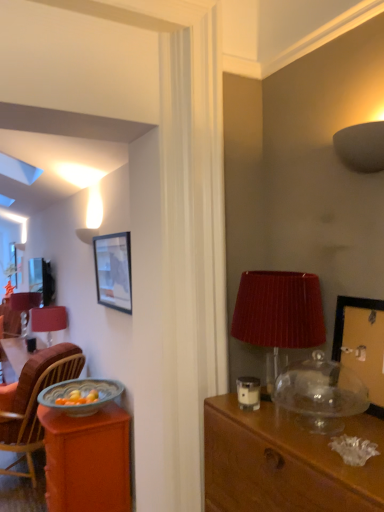
Question: Is wooden picture frame at upper right, the 1th picture frame from the front, placed right next to matte red table lamp at left?

Choices:
 (A) no
 (B) yes

Answer: (A)

Question: Does wooden picture frame at upper right, positioned as the 2th picture frame in left-to-right order, appear on the left side of matte red table lamp at left?

Choices:
 (A) yes
 (B) no

Answer: (B)

Question: Considering the relative sizes of wooden picture frame at upper right, marked as the second picture frame in a back-to-front arrangement, and matte red table lamp at left in the image provided, is wooden picture frame at upper right, marked as the second picture frame in a back-to-front arrangement, shorter than matte red table lamp at left?

Choices:
 (A) yes
 (B) no

Answer: (A)

Question: From a real-world perspective, is wooden picture frame at upper right, marked as the second picture frame in a back-to-front arrangement, positioned over matte red table lamp at left based on gravity?

Choices:
 (A) no
 (B) yes

Answer: (B)

Question: From a real-world perspective, does wooden picture frame at upper right, marked as the second picture frame in a back-to-front arrangement, sit lower than matte red table lamp at left?

Choices:
 (A) yes
 (B) no

Answer: (B)

Question: Do you think matte gray lampshade at upper right, the third lamp in the left-to-right sequence, is within matte red lampshade at right, positioned as the second lamp in back-to-front order, or outside of it?

Choices:
 (A) outside
 (B) inside

Answer: (A)

Question: From the image's perspective, is matte gray lampshade at upper right, arranged as the first lamp when viewed from the front, located above or below matte red lampshade at right, positioned as the 2th lamp in front-to-back order?

Choices:
 (A) below
 (B) above

Answer: (B)

Question: From their relative heights in the image, would you say matte gray lampshade at upper right, the third lamp in the left-to-right sequence, is taller or shorter than matte red lampshade at right, the second lamp when ordered from left to right?

Choices:
 (A) tall
 (B) short

Answer: (B)

Question: Does point (337, 139) appear closer or farther from the camera than point (304, 333)?

Choices:
 (A) closer
 (B) farther

Answer: (A)

Question: From the image's perspective, is matte red table lamp at left above or below orange wood desk at left, which is counted as the 2th desk, starting from the top?

Choices:
 (A) below
 (B) above

Answer: (B)

Question: Is matte red table lamp at left wider or thinner than orange wood desk at left, the 2th desk in the front-to-back sequence?

Choices:
 (A) thin
 (B) wide

Answer: (A)

Question: In terms of size, does matte red table lamp at left appear bigger or smaller than orange wood desk at left, the 1th desk from the back?

Choices:
 (A) big
 (B) small

Answer: (B)

Question: Is matte red table lamp at left to the left or to the right of orange wood desk at left, the 1th desk from the back, in the image?

Choices:
 (A) right
 (B) left

Answer: (B)

Question: Is matte gray lampshade at upper right, arranged as the first lamp when viewed from the front, taller or shorter than matte red lampshade at left, the 1th lamp positioned from the back?

Choices:
 (A) short
 (B) tall

Answer: (A)

Question: Is point (382, 137) positioned closer to the camera than point (59, 307)?

Choices:
 (A) farther
 (B) closer

Answer: (B)